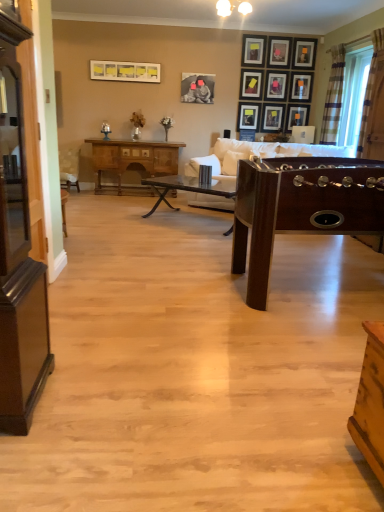
The image size is (384, 512). What are the coordinates of `vacant space underneath mahogany wood foosball table at right, positioned as the 1th table in front-to-back order (from a real-world perspective)` in the screenshot? It's located at (320, 285).